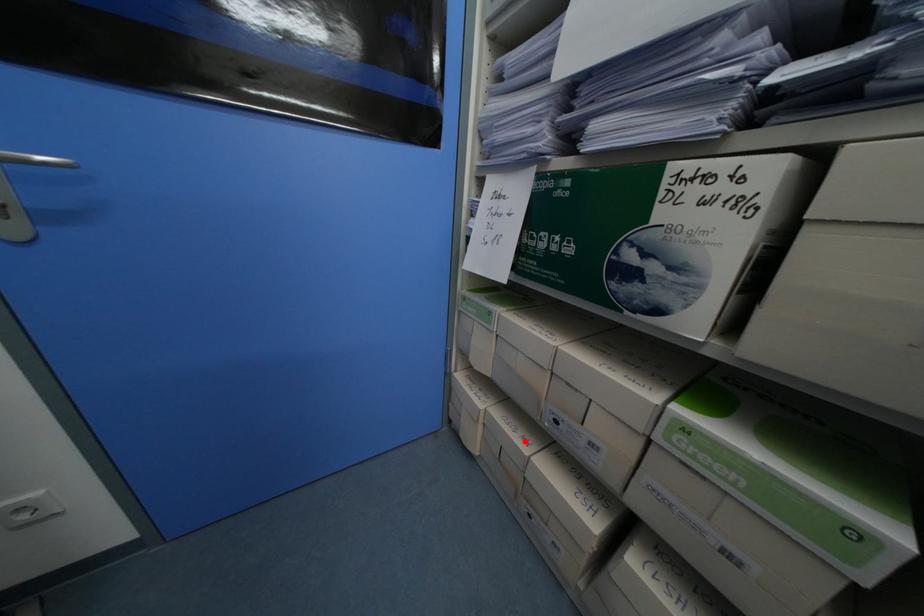
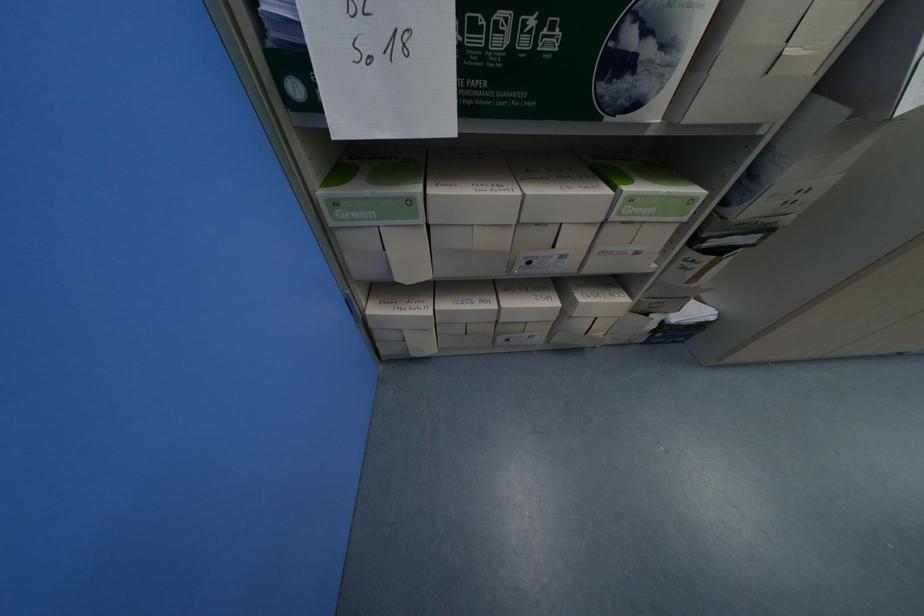
The point at the highlighted location is marked in the first image. Where is the corresponding point in the second image?

(489, 306)